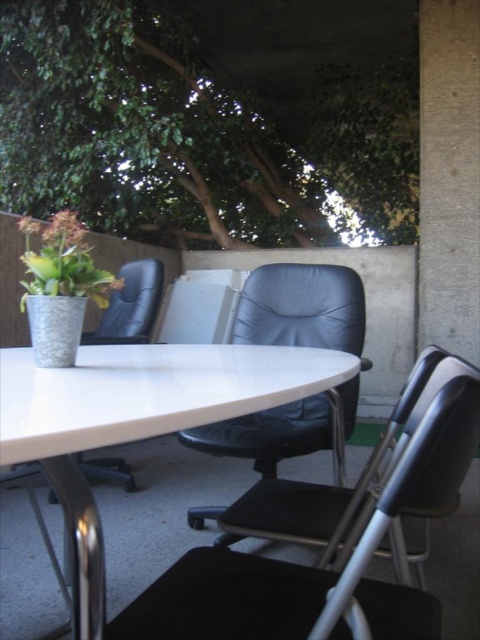
Question: Does green leafy tree at upper center appear over green matte plant at upper left?

Choices:
 (A) no
 (B) yes

Answer: (B)

Question: Is green leafy tree at upper center positioned at the back of matte black chair at center?

Choices:
 (A) yes
 (B) no

Answer: (A)

Question: Estimate the real-world distances between objects in this image. Which object is farther from the white glossy table at center?

Choices:
 (A) green leafy tree at upper center
 (B) green matte plant at upper left

Answer: (A)

Question: Which of the following is the farthest from the observer?

Choices:
 (A) (128, 272)
 (B) (382, 19)
 (C) (41, 273)
 (D) (201, 448)

Answer: (B)

Question: Which is nearer to the green leafy tree at upper center?

Choices:
 (A) green matte plant at upper left
 (B) white glossy table at center
 (C) matte black chair at center

Answer: (A)

Question: Does white glossy table at center appear under black leather chair at center?

Choices:
 (A) no
 (B) yes

Answer: (A)